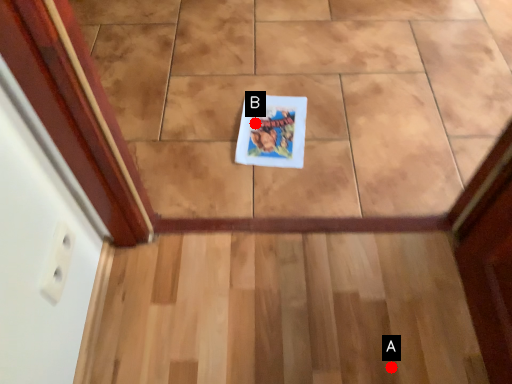
Question: Two points are circled on the image, labeled by A and B beside each circle. Which point is farther from the camera taking this photo?

Choices:
 (A) A is further
 (B) B is further

Answer: (B)